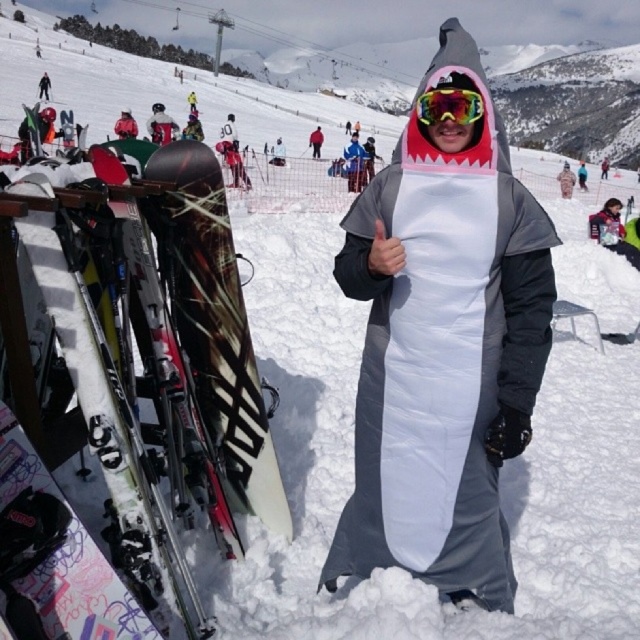
You are a ski instructor looking at the winter scene. You need to retrieve the matte black ski at left and the white matte snowboard at center for a beginner lesson. Based on their positions, which equipment is closer to the ski rack located to the left of the person in the shark costume?

The matte black ski at left is closer to the ski rack located to the left of the person in the shark costume because it is positioned to the left of the white matte snowboard at center, which is closer to the rack.

You are a photographer at the ski resort and want to capture a photo of the person in the shark costume. You need to ensure that the white glossy skis at left are not in the frame. Where should you position yourself relative to the person in the shark costume?

To avoid including the white glossy skis at left in the frame, position yourself to the right side of the person in the shark costume, as the skis are located to the left of the person.